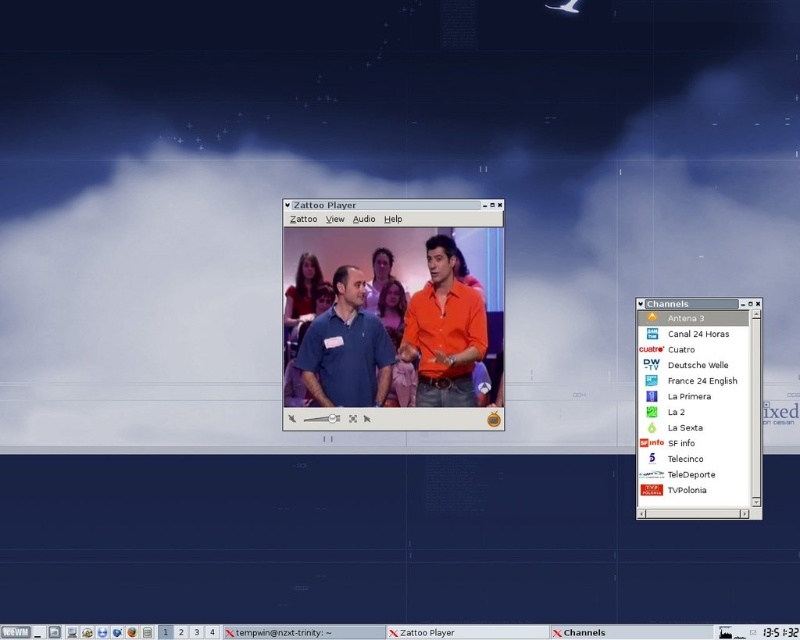
You are using the Zattoo Player application and want to see the video content clearly. Which object is located higher up on the screen between the matte blue shirt at center and the black matte zattoo player at bottom?

The matte blue shirt at center is located higher up on the screen than the black matte zattoo player at bottom.

You are using the Zattoo Player application and want to focus on the person wearing the matte orange shirt at center. What are the exact coordinates where you should click to center the view on them?

The exact coordinates to center the view on the matte orange shirt at center are point [386,312].